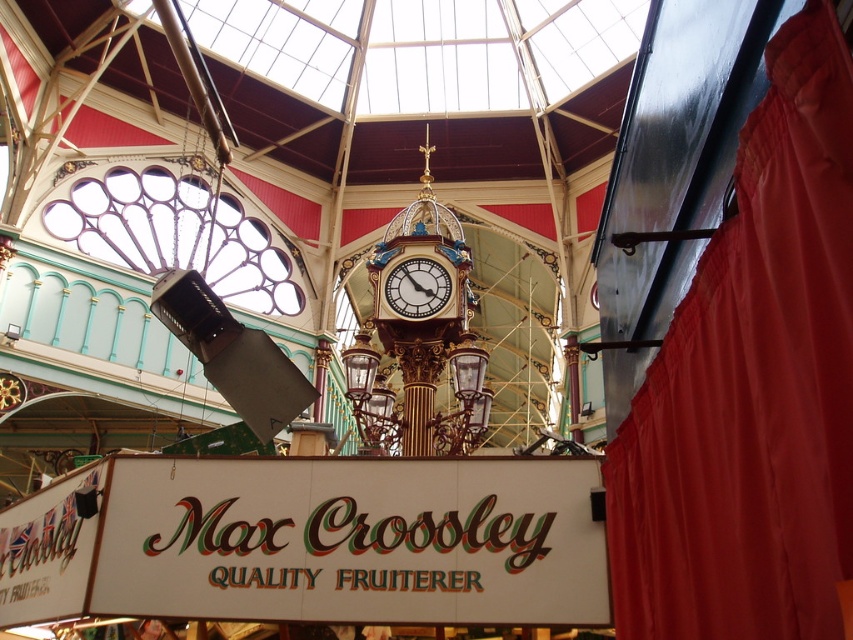
Is point (746, 237) in front of point (399, 316)?

Yes, point (746, 237) is closer to viewer.

Does red velvet curtain at right have a greater height compared to gold metallic clock at center?

Yes.

Who is more forward, (654, 579) or (434, 275)?

Point (654, 579) is more forward.

Find the location of a particular element. red velvet curtain at right is located at coordinates (752, 387).